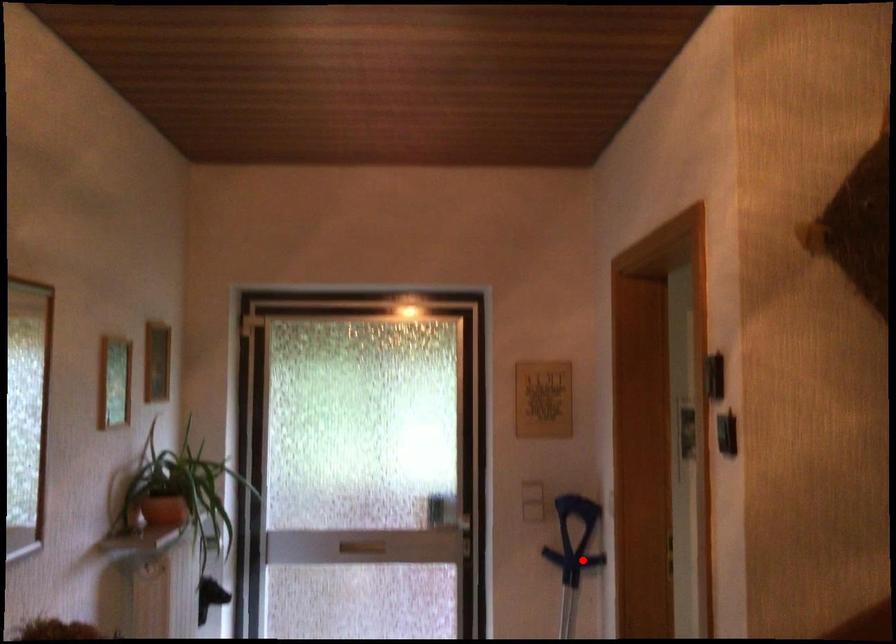
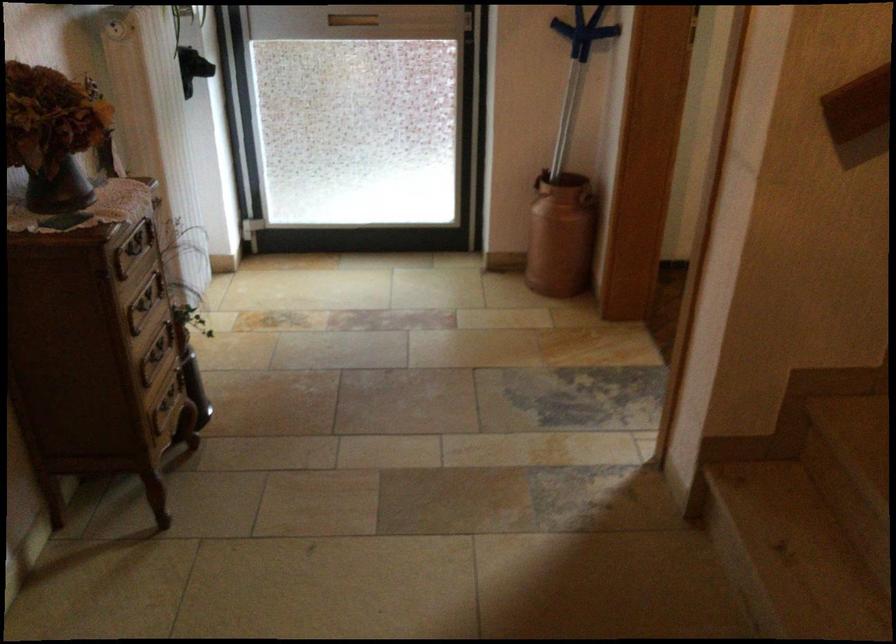
Locate, in the second image, the point that corresponds to the highlighted location in the first image.

(583, 31)